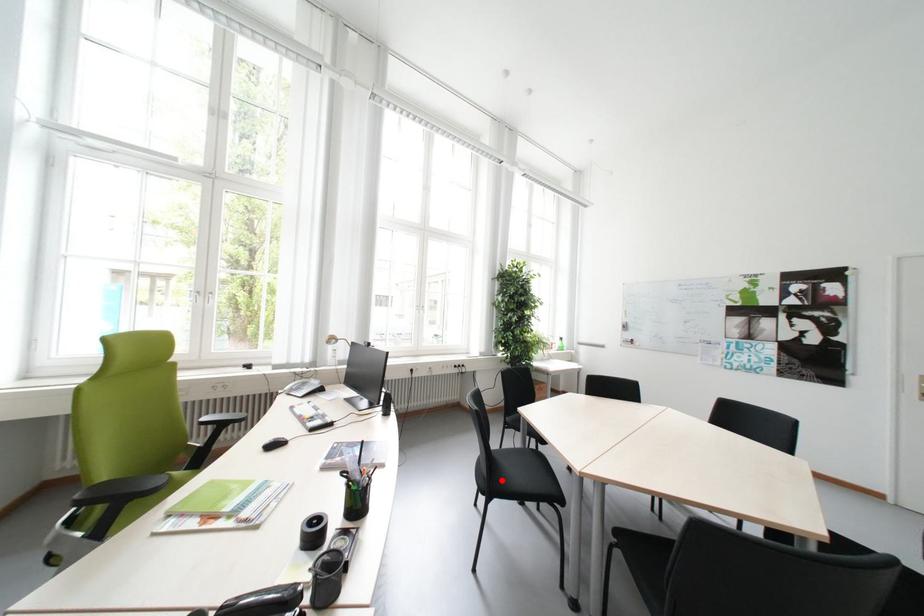
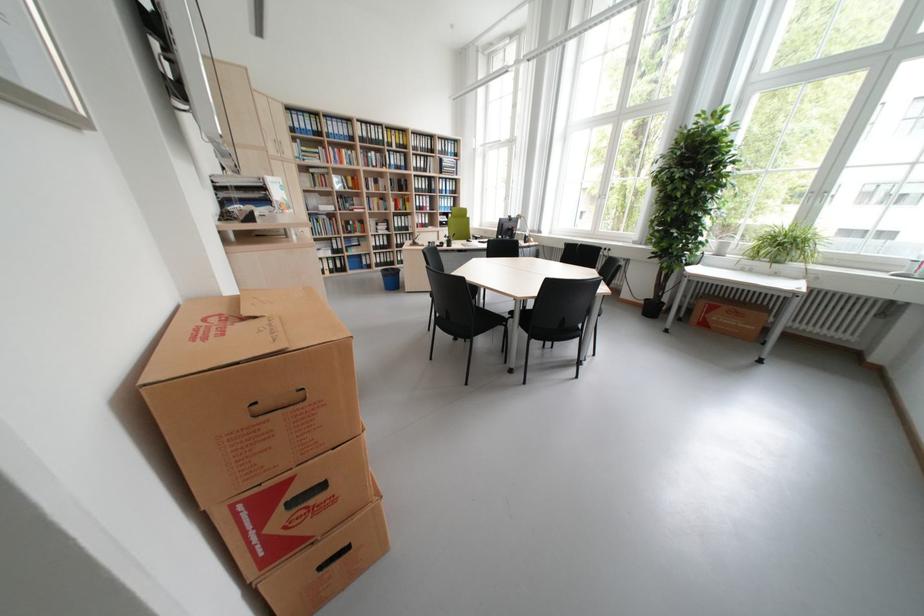
Question: I am providing you with two images of the same scene from different viewpoints. A red point is marked on the first image. Can you still see the location of the red point in image 2?

Choices:
 (A) Yes
 (B) No

Answer: (B)